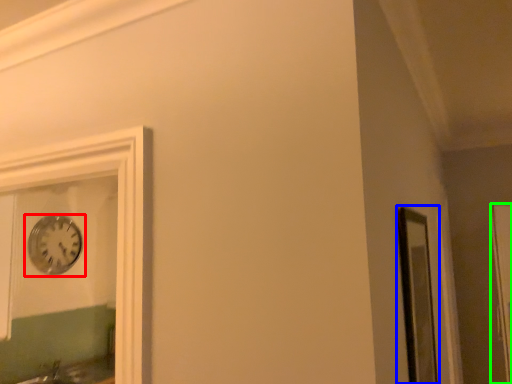
Question: Based on their relative distances, which object is nearer to wall clock (highlighted by a red box)? Choose from window frame (highlighted by a blue box) and glass door (highlighted by a green box).

Choices:
 (A) window frame
 (B) glass door

Answer: (A)